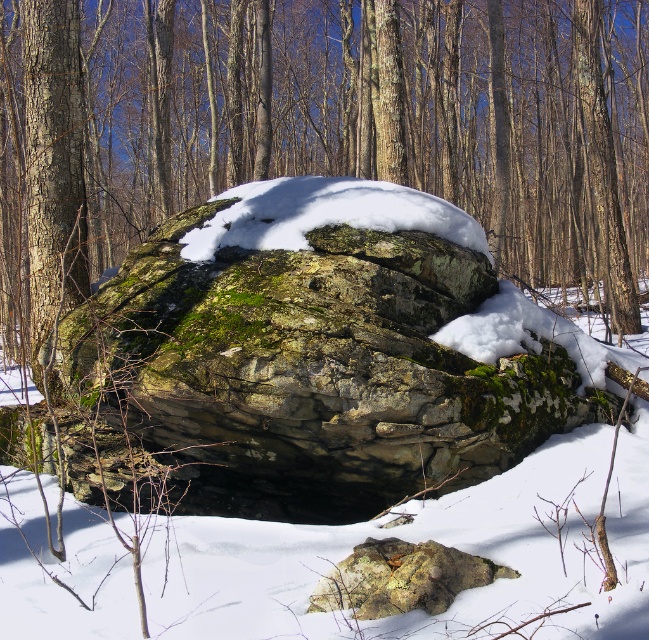
You are standing in the snowy forest looking at the image. There is a point marked at coordinates (321, 353). What object is located at that point?

The point at coordinates (321, 353) indicates the green mossy rock at center.

You are a hiker carrying a backpack and need to place a 3.5 feet long hiking pole between the green mossy rock at center and the green mossy rock at lower center. Can the pole fit between them without bending?

The distance between the green mossy rock at center and the green mossy rock at lower center is 5.14 feet, which is longer than the 3.5 feet pole. Therefore, the pole can fit between them without bending.

You are an explorer in the snowy forest and want to climb the green mossy rock at center. However, there is another green mossy rock at lower center nearby. Which rock should you avoid stepping on to reach the top?

You should avoid stepping on the green mossy rock at lower center because the green mossy rock at center is positioned over it, meaning the lower one might be unstable or part of the base structure.